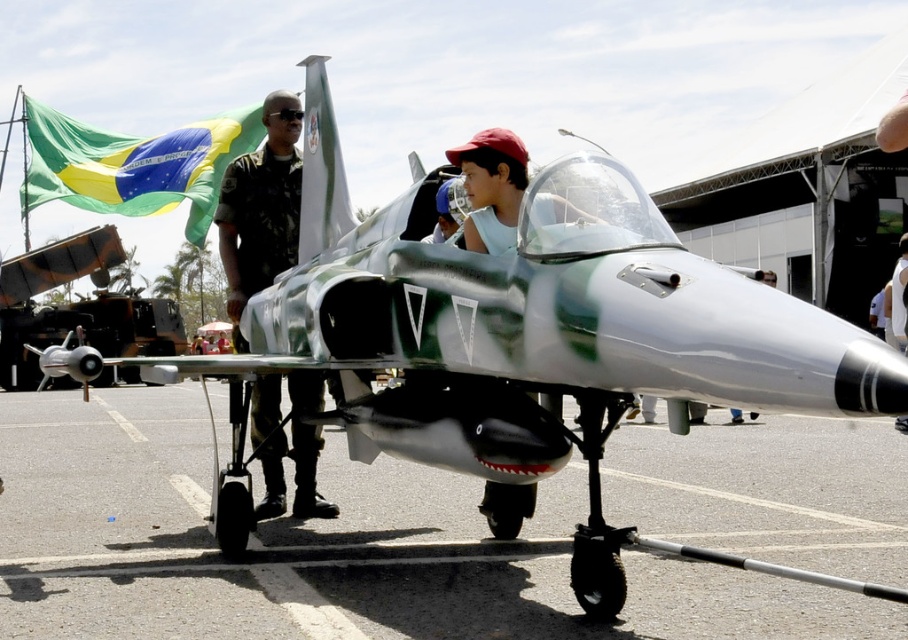
Can you confirm if camouflage uniform at center is taller than green fabric flag at upper left?

Correct, camouflage uniform at center is much taller as green fabric flag at upper left.

Is camouflage uniform at center to the right of green fabric flag at upper left from the viewer's perspective?

Correct, you'll find camouflage uniform at center to the right of green fabric flag at upper left.

Based on the photo, who is more distant from viewer, (265, 269) or (86, 147)?

Positioned behind is point (86, 147).

Identify the location of camouflage uniform at center. (260, 209).

Is point (758, 602) farther from viewer compared to point (124, 196)?

That is False.

Can you confirm if brushed metal tarmac at lower center is positioned above green fabric flag at upper left?

No, brushed metal tarmac at lower center is not above green fabric flag at upper left.

Between point (698, 634) and point (137, 182), which one is positioned in front?

Positioned in front is point (698, 634).

In order to click on brushed metal tarmac at lower center in this screenshot , I will do `click(324, 547)`.

Does brushed metal tarmac at lower center have a greater height compared to camouflage uniform at center?

No, brushed metal tarmac at lower center is not taller than camouflage uniform at center.

Does brushed metal tarmac at lower center have a larger size compared to camouflage uniform at center?

Yes.

Which is behind, point (899, 440) or point (248, 243)?

The point (899, 440) is behind.

Where is `brushed metal tarmac at lower center`? brushed metal tarmac at lower center is located at coordinates (324, 547).